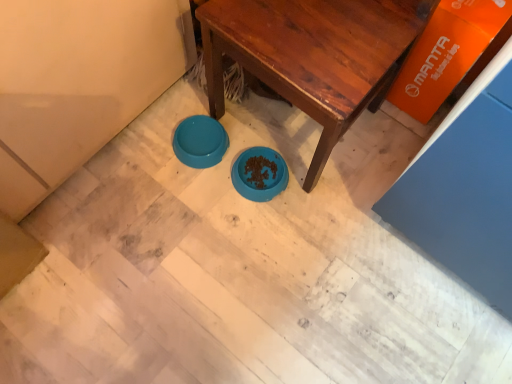
Question: From their relative heights in the image, would you say wooden table at center is taller or shorter than teal plastic bowl at center?

Choices:
 (A) tall
 (B) short

Answer: (A)

Question: From the image's perspective, relative to teal plastic bowl at center, is wooden table at center above or below?

Choices:
 (A) above
 (B) below

Answer: (A)

Question: Considering their positions, is wooden table at center located in front of or behind teal plastic bowl at center?

Choices:
 (A) front
 (B) behind

Answer: (A)

Question: Is teal plastic bowl at center inside the boundaries of wooden table at center, or outside?

Choices:
 (A) outside
 (B) inside

Answer: (A)

Question: Based on their positions, is teal plastic bowl at center located to the left or right of wooden table at center?

Choices:
 (A) left
 (B) right

Answer: (A)

Question: Is teal plastic bowl at center taller or shorter than wooden table at center?

Choices:
 (A) tall
 (B) short

Answer: (B)

Question: Based on their sizes in the image, would you say teal plastic bowl at center is bigger or smaller than wooden table at center?

Choices:
 (A) big
 (B) small

Answer: (B)